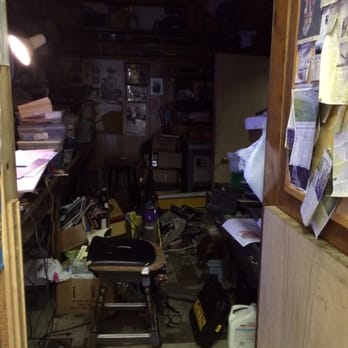
In order to click on stool in this screenshot , I will do `click(143, 281)`.